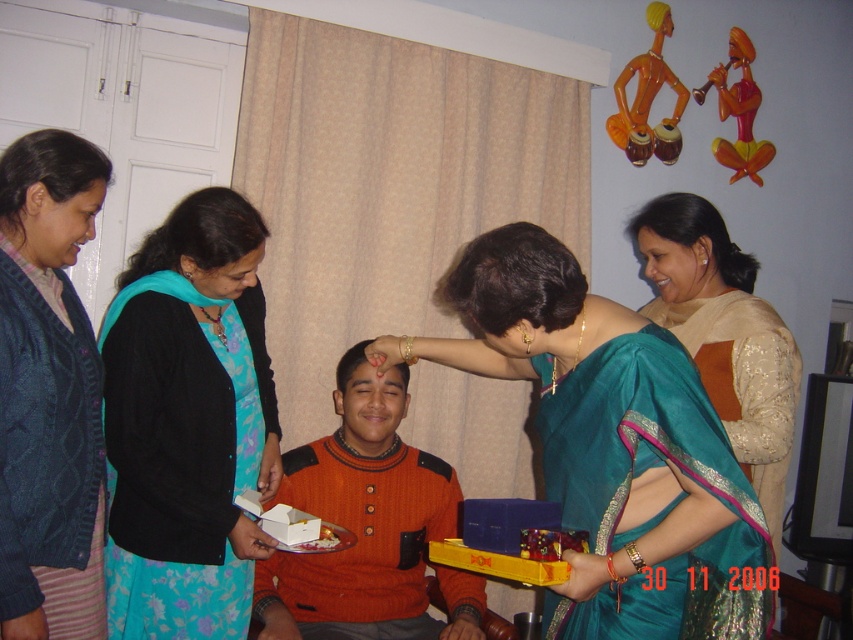
Which is in front, point (393, 618) or point (485, 499)?

Point (485, 499) is more forward.

Does point (418, 593) come behind point (479, 515)?

That is True.

This screenshot has height=640, width=853. I want to click on orange knitted sweater at center, so click(x=367, y=525).

Can you confirm if teal silk saree at upper right is smaller than yellow plastic tray at lower center?

No, teal silk saree at upper right is not smaller than yellow plastic tray at lower center.

The image size is (853, 640). What do you see at coordinates (724, 336) in the screenshot?
I see `teal silk saree at upper right` at bounding box center [724, 336].

This screenshot has width=853, height=640. Identify the location of teal silk saree at upper right. (724, 336).

Between point (50, 307) and point (576, 545), which one is positioned in front?

Point (576, 545) is more forward.

Which is in front, point (48, 481) or point (517, 534)?

Point (517, 534)

Where is `knitted dark blue cardigan at left`? The height and width of the screenshot is (640, 853). knitted dark blue cardigan at left is located at coordinates (44, 449).